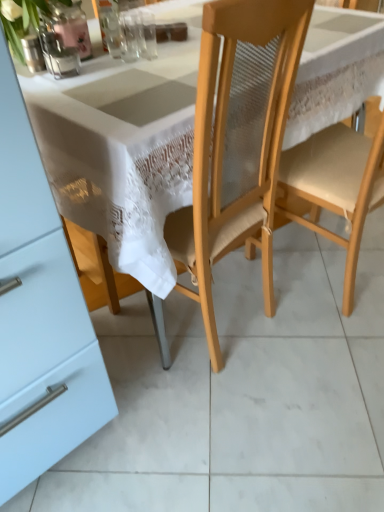
Find the location of `free area in between transparent glass at upper center, placed as the 3th tableware when sorted from left to right, and clear glass vase at upper center, the second tableware from the right`. free area in between transparent glass at upper center, placed as the 3th tableware when sorted from left to right, and clear glass vase at upper center, the second tableware from the right is located at coordinates (122, 50).